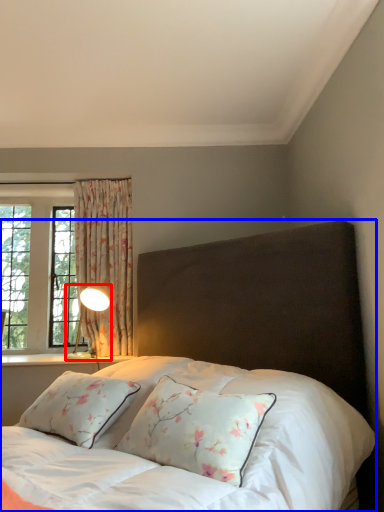
Question: Which object appears farthest to the camera in this image, table lamp (highlighted by a red box) or bed (highlighted by a blue box)?

Choices:
 (A) table lamp
 (B) bed

Answer: (A)